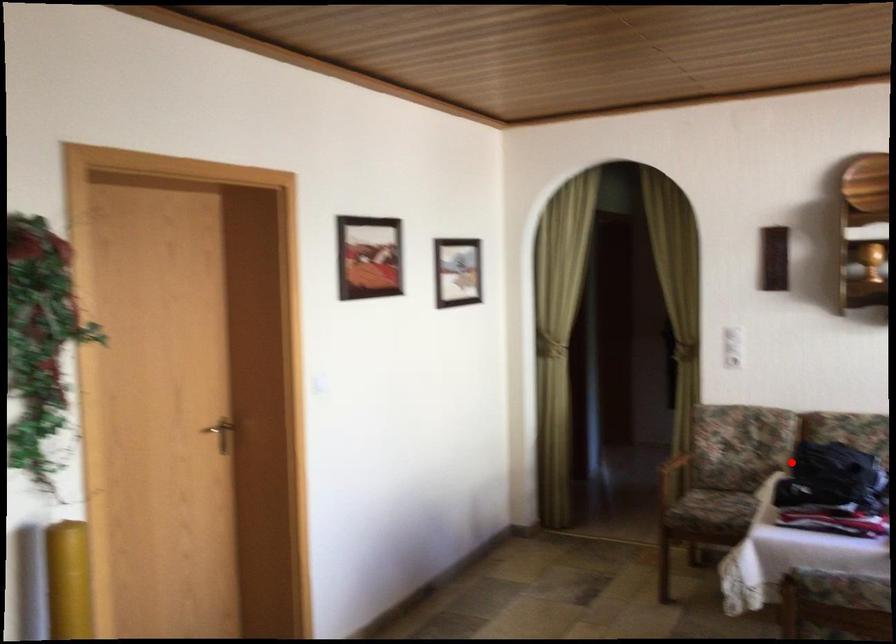
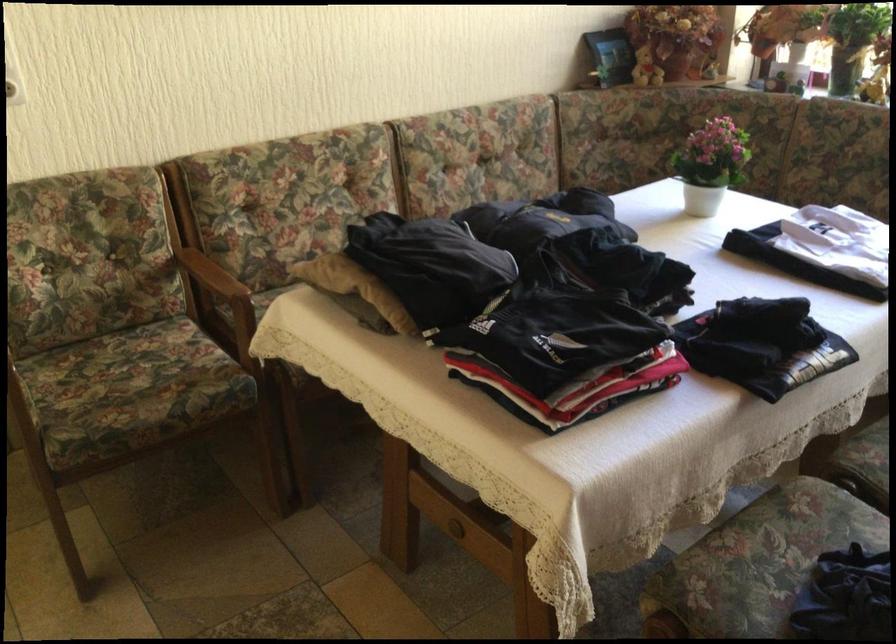
The point at the highlighted location is marked in the first image. Where is the corresponding point in the second image?

(355, 287)